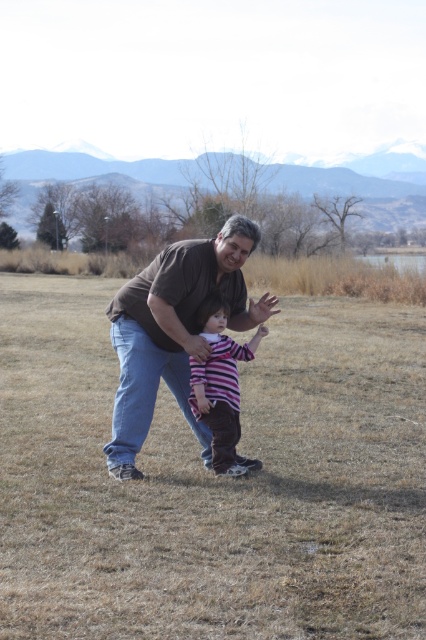
Question: Where is brown dry grass at center located in relation to brown cotton shirt at center in the image?

Choices:
 (A) above
 (B) below

Answer: (B)

Question: Among these objects, which one is farthest from the camera?

Choices:
 (A) brown dry grass at center
 (B) striped cotton shirt at center

Answer: (B)

Question: Is brown dry grass at center wider than brown cotton shirt at center?

Choices:
 (A) no
 (B) yes

Answer: (B)

Question: Which object appears closest to the camera in this image?

Choices:
 (A) brown cotton shirt at center
 (B) striped cotton shirt at center

Answer: (A)

Question: Which point is farther from the camera taking this photo?

Choices:
 (A) (83, 444)
 (B) (155, 278)
 (C) (207, 301)

Answer: (A)

Question: Does brown dry grass at center come behind brown cotton shirt at center?

Choices:
 (A) no
 (B) yes

Answer: (A)